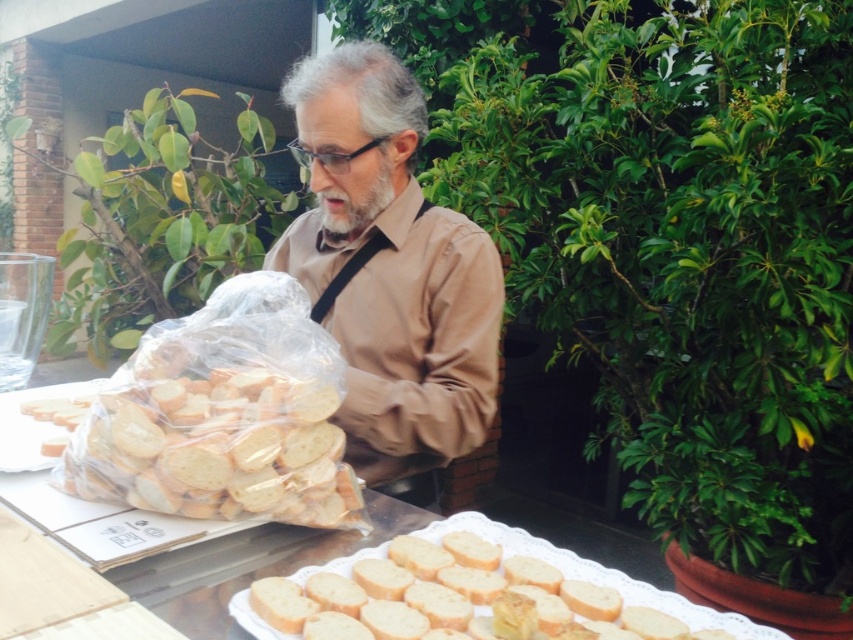
Is matte brown shirt at center wider than golden brown crusty bread at lower center?

Yes, matte brown shirt at center is wider than golden brown crusty bread at lower center.

Between point (328, 234) and point (395, 541), which one is positioned behind?

The point (328, 234) is more distant.

Where is `matte brown shirt at center`? Image resolution: width=853 pixels, height=640 pixels. matte brown shirt at center is located at coordinates (389, 268).